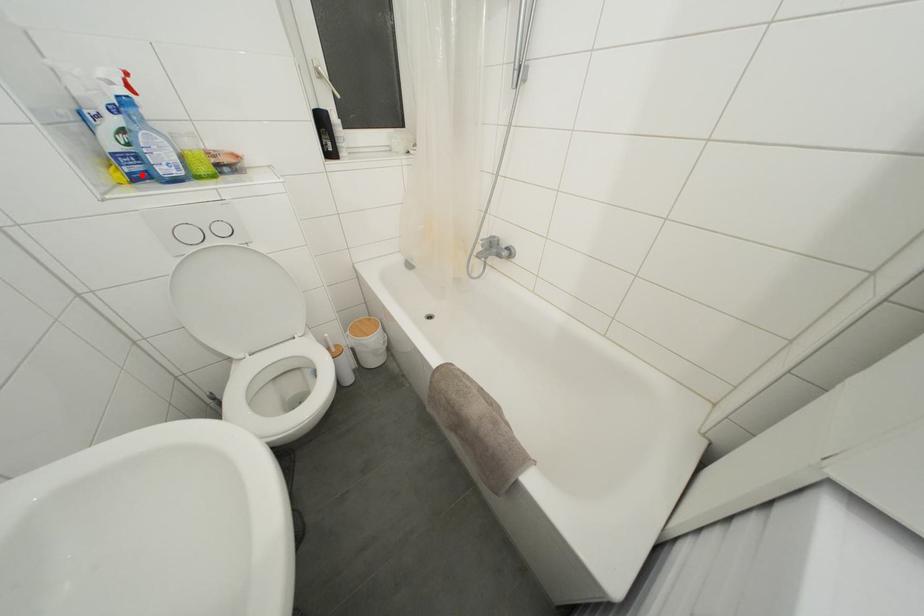
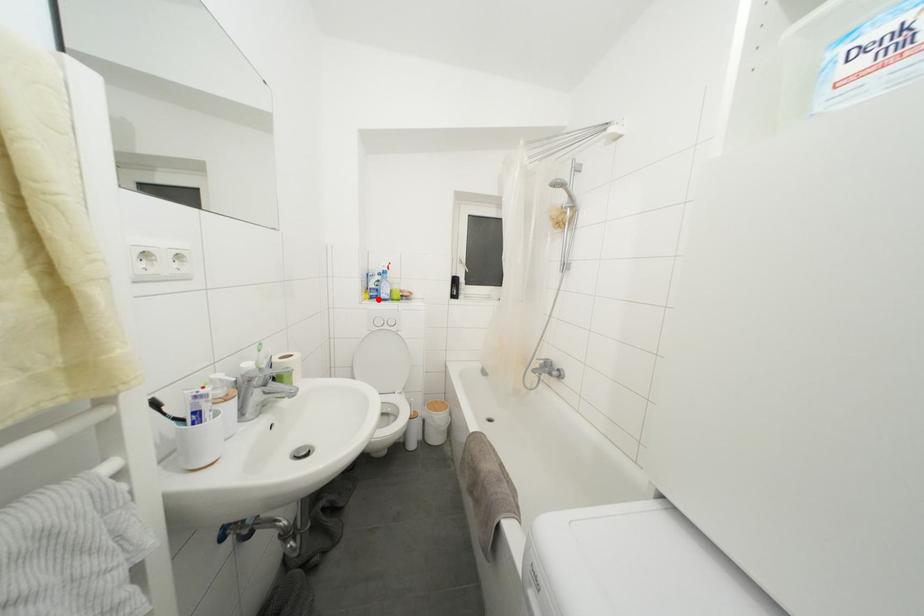
I am providing you with two images of the same scene from different viewpoints. A red point is marked on the first image and another point is marked on the second image. Are the points marked in image1 and image2 representing the same 3D position?

Yes